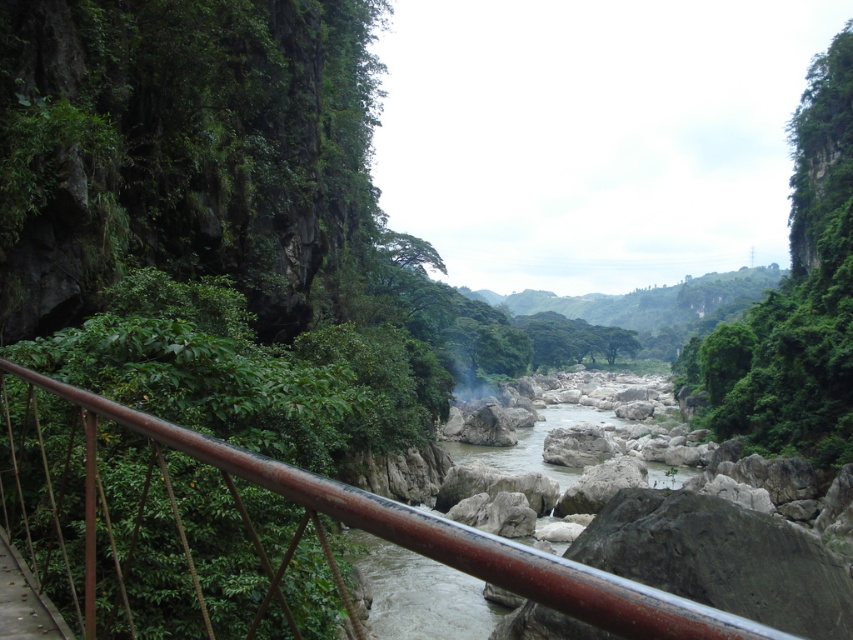
Question: Which of the following is the closest to the observer?

Choices:
 (A) (358, 509)
 (B) (448, 637)

Answer: (A)

Question: Is green leafy vegetation at upper center further to the viewer compared to white smooth rocks at center?

Choices:
 (A) yes
 (B) no

Answer: (A)

Question: Does green leafy vegetation at upper center appear on the right side of white smooth rocks at center?

Choices:
 (A) yes
 (B) no

Answer: (A)

Question: Which is farther from the white smooth rocks at center?

Choices:
 (A) rusty metal railing at lower left
 (B) green leafy vegetation at upper center

Answer: (A)

Question: Is green leafy vegetation at upper center smaller than white smooth rocks at center?

Choices:
 (A) yes
 (B) no

Answer: (B)

Question: Which object appears closest to the camera in this image?

Choices:
 (A) rusty metal railing at lower left
 (B) white smooth rocks at center
 (C) green leafy vegetation at upper center

Answer: (A)